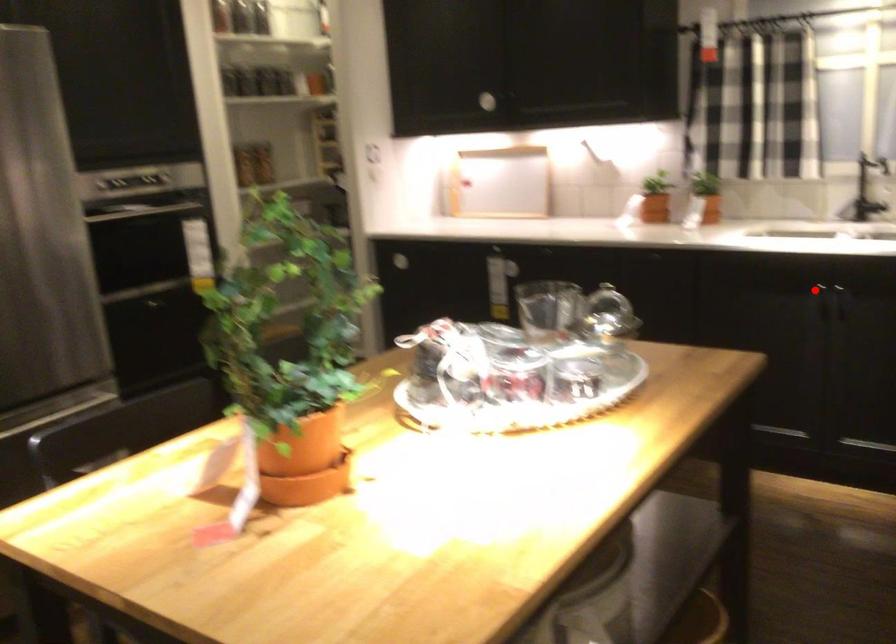
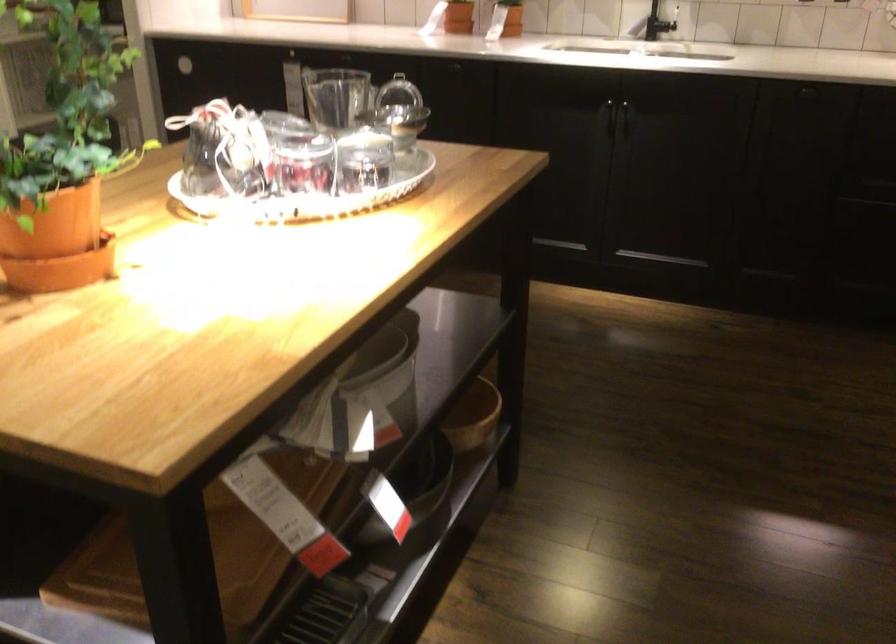
The point at the highlighted location is marked in the first image. Where is the corresponding point in the second image?

(599, 107)